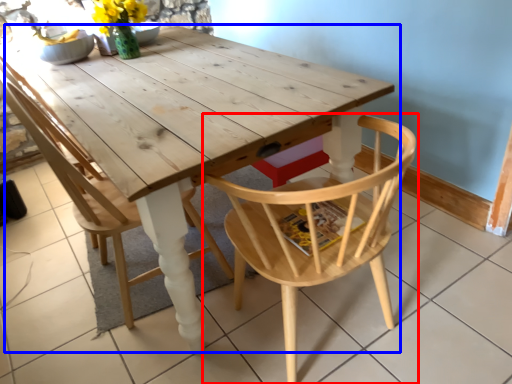
Question: Which point is closer to the camera, chair (highlighted by a red box) or table (highlighted by a blue box)?

Choices:
 (A) chair
 (B) table

Answer: (B)